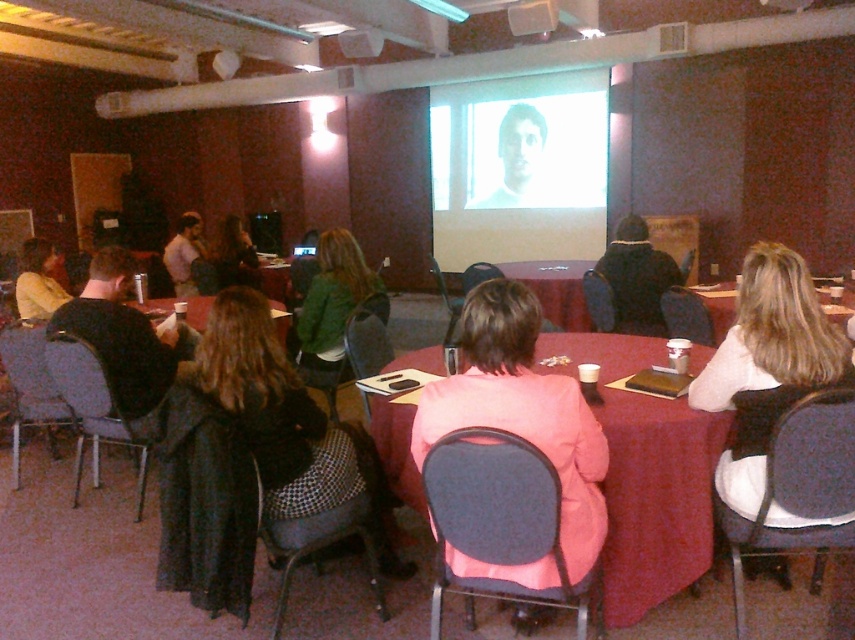
You are a person who wants to place a laptop on the maroon fabric table at center without it falling off. Considering the black fuzzy coat at center is also present, what should you be cautious about?

The maroon fabric table at center has a lesser height compared to black fuzzy coat at center, so you should be cautious about placing the laptop on the maroon fabric table at center to ensure it doesn

You are a guest entering the conference room and see the black fuzzy coat at center and the smooth black table at center. Which object is closer to you?

The black fuzzy coat at center is closer to you because it is positioned in front of the smooth black table at center.